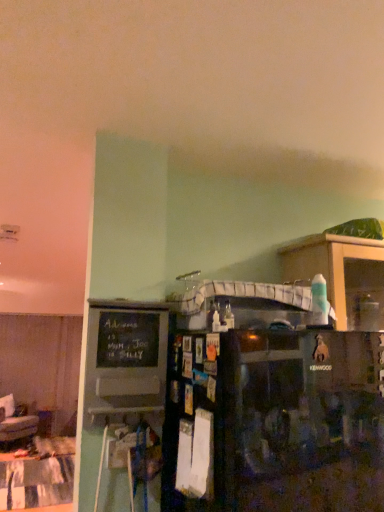
Question: From the image's perspective, is black chalkboard at left positioned above or below wooden cabinet at right?

Choices:
 (A) above
 (B) below

Answer: (B)

Question: Considering the positions of black chalkboard at left and wooden cabinet at right in the image, is black chalkboard at left taller or shorter than wooden cabinet at right?

Choices:
 (A) tall
 (B) short

Answer: (A)

Question: Which of these objects is positioned farthest from the wooden cabinet at right?

Choices:
 (A) patchwork fabric table at lower left
 (B) black matte refrigerator at center
 (C) black chalkboard at left

Answer: (A)

Question: Based on their relative distances, which object is nearer to the patchwork fabric table at lower left?

Choices:
 (A) black matte refrigerator at center
 (B) wooden cabinet at right
 (C) black chalkboard at left

Answer: (C)